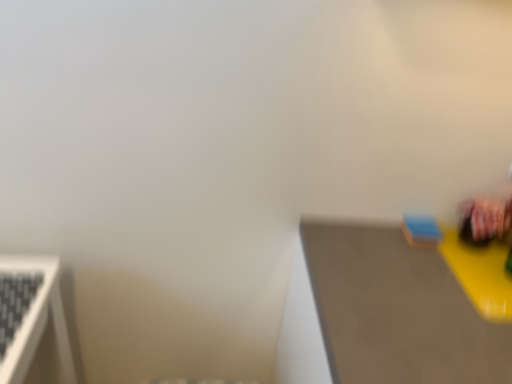
Question: Can you confirm if blue matte sponge at upper right, which is the first toy in left-to-right order, is shorter than smooth gray table at right?

Choices:
 (A) no
 (B) yes

Answer: (B)

Question: Is there a large distance between blue matte sponge at upper right, placed as the 2th toy when sorted from right to left, and smooth gray table at right?

Choices:
 (A) yes
 (B) no

Answer: (B)

Question: Is blue matte sponge at upper right, which is the first toy in left-to-right order, taller than smooth gray table at right?

Choices:
 (A) no
 (B) yes

Answer: (A)

Question: Can you confirm if blue matte sponge at upper right, which is the first toy in left-to-right order, is thinner than smooth gray table at right?

Choices:
 (A) no
 (B) yes

Answer: (B)

Question: Considering the relative positions of blue matte sponge at upper right, placed as the 2th toy when sorted from right to left, and smooth gray table at right in the image provided, is blue matte sponge at upper right, placed as the 2th toy when sorted from right to left, to the right of smooth gray table at right from the viewer's perspective?

Choices:
 (A) no
 (B) yes

Answer: (A)

Question: Is smooth gray table at right at the back of blue matte sponge at upper right, placed as the 2th toy when sorted from right to left?

Choices:
 (A) no
 (B) yes

Answer: (A)

Question: Is matte plastic toy at right, which appears as the 2th toy when viewed from the left, at the back of blue matte sponge at upper right, placed as the 2th toy when sorted from right to left?

Choices:
 (A) yes
 (B) no

Answer: (B)

Question: Considering the relative sizes of blue matte sponge at upper right, placed as the 2th toy when sorted from right to left, and matte plastic toy at right, which appears as the 2th toy when viewed from the left, in the image provided, is blue matte sponge at upper right, placed as the 2th toy when sorted from right to left, taller than matte plastic toy at right, which appears as the 2th toy when viewed from the left,?

Choices:
 (A) yes
 (B) no

Answer: (B)

Question: Considering the relative positions of blue matte sponge at upper right, placed as the 2th toy when sorted from right to left, and matte plastic toy at right, which appears as the 2th toy when viewed from the left, in the image provided, is blue matte sponge at upper right, placed as the 2th toy when sorted from right to left, to the right of matte plastic toy at right, which appears as the 2th toy when viewed from the left, from the viewer's perspective?

Choices:
 (A) yes
 (B) no

Answer: (B)

Question: From a real-world perspective, is blue matte sponge at upper right, which is the first toy in left-to-right order, on top of matte plastic toy at right, which is counted as the 1th toy, starting from the right?

Choices:
 (A) no
 (B) yes

Answer: (A)

Question: Is matte plastic toy at right, which is counted as the 1th toy, starting from the right, located within blue matte sponge at upper right, which is the first toy in left-to-right order?

Choices:
 (A) no
 (B) yes

Answer: (A)

Question: From a real-world perspective, is blue matte sponge at upper right, placed as the 2th toy when sorted from right to left, located beneath matte plastic toy at right, which appears as the 2th toy when viewed from the left?

Choices:
 (A) yes
 (B) no

Answer: (A)

Question: Is smooth gray table at right oriented away from blue matte sponge at upper right, placed as the 2th toy when sorted from right to left?

Choices:
 (A) yes
 (B) no

Answer: (B)